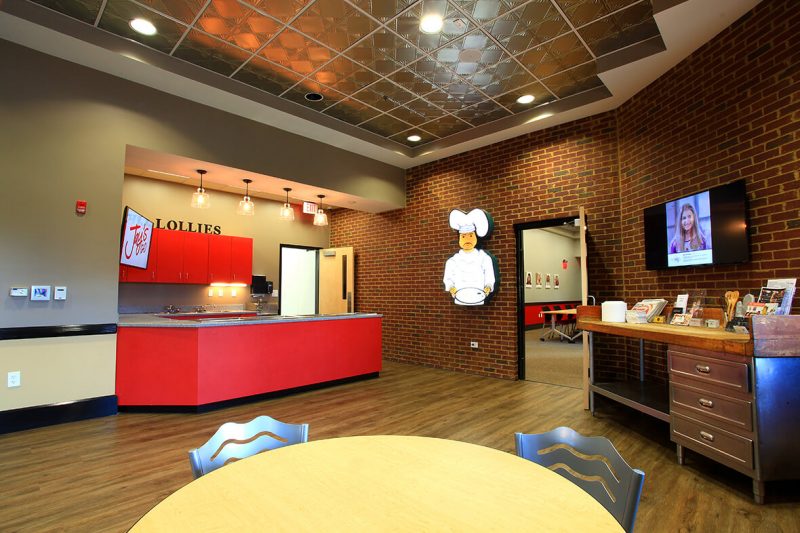
Identify the location of wall. The width and height of the screenshot is (800, 533). (86, 250), (466, 323), (548, 257), (726, 156).